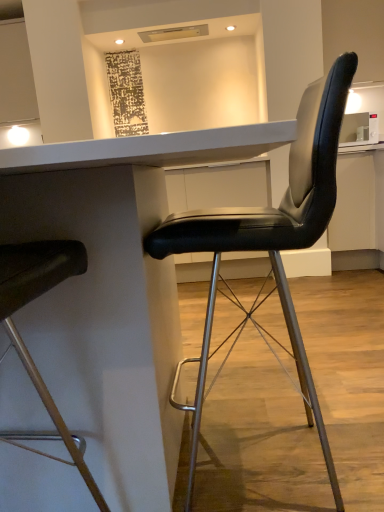
Question: Does black leather chair at right, the first chair in the right-to-left sequence, touch white glossy table at center?

Choices:
 (A) yes
 (B) no

Answer: (B)

Question: Is white glossy table at center inside black leather chair at right, the first chair in the right-to-left sequence?

Choices:
 (A) yes
 (B) no

Answer: (B)

Question: Can you confirm if black leather chair at right, acting as the 2th chair starting from the left, is taller than white glossy table at center?

Choices:
 (A) yes
 (B) no

Answer: (A)

Question: Is black leather chair at right, the first chair in the right-to-left sequence, located outside white glossy table at center?

Choices:
 (A) no
 (B) yes

Answer: (A)

Question: From a real-world perspective, does black leather chair at right, acting as the 2th chair starting from the left, stand above white glossy table at center?

Choices:
 (A) no
 (B) yes

Answer: (B)

Question: In terms of size, does white glossy table at center appear bigger or smaller than matte black chair at left, the 1th chair in the left-to-right sequence?

Choices:
 (A) big
 (B) small

Answer: (A)

Question: From the image's perspective, is white glossy table at center above or below matte black chair at left, the 1th chair in the left-to-right sequence?

Choices:
 (A) below
 (B) above

Answer: (A)

Question: Relative to matte black chair at left, which appears as the 2th chair when viewed from the right, is white glossy table at center in front or behind?

Choices:
 (A) behind
 (B) front

Answer: (A)

Question: Is white glossy table at center inside or outside of matte black chair at left, which appears as the 2th chair when viewed from the right?

Choices:
 (A) outside
 (B) inside

Answer: (A)

Question: From a real-world perspective, relative to black leather chair at right, the first chair in the right-to-left sequence, is matte black chair at left, which appears as the 2th chair when viewed from the right, vertically above or below?

Choices:
 (A) below
 (B) above

Answer: (B)

Question: Would you say matte black chair at left, the 1th chair in the left-to-right sequence, is inside or outside black leather chair at right, acting as the 2th chair starting from the left?

Choices:
 (A) outside
 (B) inside

Answer: (A)

Question: From the image's perspective, is matte black chair at left, the 1th chair in the left-to-right sequence, above or below black leather chair at right, the first chair in the right-to-left sequence?

Choices:
 (A) above
 (B) below

Answer: (B)

Question: Considering the relative positions of matte black chair at left, the 1th chair in the left-to-right sequence, and black leather chair at right, acting as the 2th chair starting from the left, in the image provided, is matte black chair at left, the 1th chair in the left-to-right sequence, to the left or to the right of black leather chair at right, acting as the 2th chair starting from the left,?

Choices:
 (A) left
 (B) right

Answer: (A)

Question: Considering the positions of point (251, 208) and point (49, 258), is point (251, 208) closer or farther from the camera than point (49, 258)?

Choices:
 (A) closer
 (B) farther

Answer: (B)

Question: In the image, is black leather chair at right, the first chair in the right-to-left sequence, positioned in front of or behind matte black chair at left, the 1th chair in the left-to-right sequence?

Choices:
 (A) behind
 (B) front

Answer: (A)